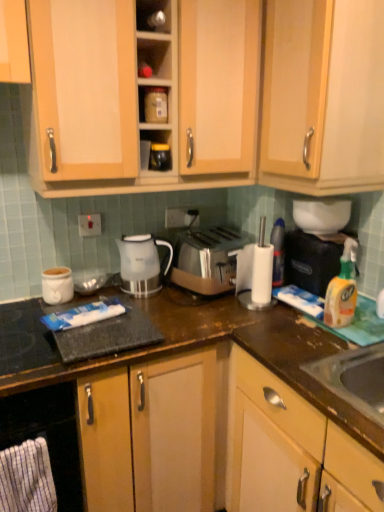
Identify the location of white glossy jar at left, the first appliance positioned from the left. The image size is (384, 512). (57, 285).

Locate an element on the screen. The image size is (384, 512). matte plastic container at upper center, placed as the second shelf when sorted from top to bottom is located at coordinates (153, 104).

I want to click on metallic silver container at upper center, the 1th shelf in the top-to-bottom sequence, so click(154, 16).

From the image's perspective, between white glossy kettle at center and translucent plastic spray bottle at right, placed as the fourth appliance when sorted from left to right, who is located below?

translucent plastic spray bottle at right, placed as the fourth appliance when sorted from left to right.

Which is in front, point (132, 260) or point (306, 273)?

Positioned in front is point (306, 273).

Is white glossy kettle at center positioned far away from translucent plastic spray bottle at right, placed as the fourth appliance when sorted from left to right?

white glossy kettle at center is actually quite close to translucent plastic spray bottle at right, placed as the fourth appliance when sorted from left to right.

Between white glossy kettle at center and translucent plastic spray bottle at right, placed as the fourth appliance when sorted from left to right, which one has smaller size?

white glossy kettle at center is smaller.

In the scene shown: From the image's perspective, which one is positioned higher, white plastic blender at center or translucent plastic spray bottle at right, placed as the fourth appliance when sorted from left to right?

white plastic blender at center appears higher in the image.

Between white plastic blender at center and translucent plastic spray bottle at right, the 1th appliance positioned from the right, which one appears on the right side from the viewer's perspective?

Positioned to the right is translucent plastic spray bottle at right, the 1th appliance positioned from the right.

Is white plastic blender at center situated inside translucent plastic spray bottle at right, the 1th appliance positioned from the right, or outside?

white plastic blender at center lies outside translucent plastic spray bottle at right, the 1th appliance positioned from the right.

From a real-world perspective, which is physically below, white plastic blender at center or translucent plastic spray bottle at right, placed as the fourth appliance when sorted from left to right?

translucent plastic spray bottle at right, placed as the fourth appliance when sorted from left to right, is physically lower.

Is white striped cloth at lower left facing towards light wood cabinet at upper center, which is the 2th cabinetry from top to bottom?

No.

Looking at this image, measure the distance from white striped cloth at lower left to light wood cabinet at upper center, which is the 2th cabinetry from top to bottom.

white striped cloth at lower left and light wood cabinet at upper center, which is the 2th cabinetry from top to bottom, are 1.29 meters apart.

Is white striped cloth at lower left taller than light wood cabinet at upper center, which is the 2th cabinetry from top to bottom?

No.

Is white striped cloth at lower left bigger than light wood cabinet at upper center, which is the 2th cabinetry from top to bottom?

No.

The height and width of the screenshot is (512, 384). What are the coordinates of `kitchen appliance below the white plastic electric outlet at center, which is the first electric outlet in back-to-front order (from a real-world perspective)` in the screenshot? It's located at (141, 264).

Does white plastic electric outlet at center, placed as the second electric outlet when sorted from front to back, come behind white glossy kettle at center?

Yes, the depth of white plastic electric outlet at center, placed as the second electric outlet when sorted from front to back, is greater than that of white glossy kettle at center.

Considering the relative sizes of white plastic electric outlet at center, which is the first electric outlet in back-to-front order, and white glossy kettle at center in the image provided, is white plastic electric outlet at center, which is the first electric outlet in back-to-front order, shorter than white glossy kettle at center?

Yes.

From a real-world perspective, between white plastic electric outlet at center, marked as the 1th electric outlet in a right-to-left arrangement, and white glossy kettle at center, who is vertically higher?

white plastic electric outlet at center, marked as the 1th electric outlet in a right-to-left arrangement, from a real-world perspective.

What's the angular difference between matte plastic container at upper center, placed as the second shelf when sorted from top to bottom, and white glossy kettle at center's facing directions?

There is a 1.17-degree angle between the facing directions of matte plastic container at upper center, placed as the second shelf when sorted from top to bottom, and white glossy kettle at center.

Can you confirm if matte plastic container at upper center, placed as the second shelf when sorted from top to bottom, is wider than white glossy kettle at center?

No.

Which object is positioned more to the right, matte plastic container at upper center, which ranks as the 1th shelf in bottom-to-top order, or white glossy kettle at center?

matte plastic container at upper center, which ranks as the 1th shelf in bottom-to-top order.

Is matte plastic container at upper center, placed as the second shelf when sorted from top to bottom, facing away from white glossy kettle at center?

No.

I want to click on oven that appears below the metallic silver container at upper center, the 1th shelf in the top-to-bottom sequence (from the image's perspective), so click(x=48, y=435).

Looking at this image, can you confirm if metallic silver container at upper center, the 1th shelf in the top-to-bottom sequence, is thinner than black matte oven at lower left?

Yes, metallic silver container at upper center, the 1th shelf in the top-to-bottom sequence, is thinner than black matte oven at lower left.

From a real-world perspective, is metallic silver container at upper center, which is the 2th shelf in bottom-to-top order, beneath black matte oven at lower left?

Actually, metallic silver container at upper center, which is the 2th shelf in bottom-to-top order, is physically above black matte oven at lower left in the real world.

Are white plastic electric outlet at center, marked as the 1th electric outlet in a right-to-left arrangement, and white striped cloth at lower left far apart?

A: Absolutely, white plastic electric outlet at center, marked as the 1th electric outlet in a right-to-left arrangement, is distant from white striped cloth at lower left.

Is white plastic electric outlet at center, placed as the second electric outlet when sorted from front to back, facing away from white striped cloth at lower left?

No, white plastic electric outlet at center, placed as the second electric outlet when sorted from front to back, is not facing the opposite direction of white striped cloth at lower left.

Measure the distance from white plastic electric outlet at center, positioned as the 2th electric outlet in left-to-right order, to white striped cloth at lower left.

1.05 meters.

Which is more to the left, white plastic electric outlet at center, placed as the second electric outlet when sorted from front to back, or white striped cloth at lower left?

From the viewer's perspective, white striped cloth at lower left appears more on the left side.

Where is `kitchen appliance located above the translucent plastic spray bottle at right, the 1th appliance positioned from the right (from the image's perspective)`? The image size is (384, 512). kitchen appliance located above the translucent plastic spray bottle at right, the 1th appliance positioned from the right (from the image's perspective) is located at coordinates (141, 264).

Find the location of a particular element. Image resolution: width=384 pixels, height=512 pixels. the 1st appliance below the white plastic blender at center (from the image's perspective) is located at coordinates (311, 261).

Based on their spatial positions, is satin silver toaster at center or white plastic paper towel holder at right closer to metallic silver container at upper center, which is the 2th shelf in bottom-to-top order?

Among the two, satin silver toaster at center is located nearer to metallic silver container at upper center, which is the 2th shelf in bottom-to-top order.

Based on their spatial positions, is wooden cabinet at center, which is counted as the 1th cabinetry, starting from the bottom, or matte plastic container at upper center, placed as the second shelf when sorted from top to bottom, closer to satin silver toaster at center?

Among the two, wooden cabinet at center, which is counted as the 1th cabinetry, starting from the bottom, is located nearer to satin silver toaster at center.

Considering their positions, is satin silver toaster at center positioned closer to white plastic electric outlet at center, positioned as the 2th electric outlet in left-to-right order, than white plastic paper towel holder at right?

Among the two, satin silver toaster at center is located nearer to white plastic electric outlet at center, positioned as the 2th electric outlet in left-to-right order.

From the image, which object appears to be nearer to white plastic electric outlet at center, placed as the second electric outlet when sorted from front to back, wooden cabinet at center, which is counted as the 1th cabinetry, starting from the bottom, or matte plastic container at upper center, placed as the second shelf when sorted from top to bottom?

matte plastic container at upper center, placed as the second shelf when sorted from top to bottom.

When comparing their distances from black matte oven at lower left, does wooden cabinet at upper center, the 1th cabinetry viewed from the top, or light wood cabinet at upper center, which is the 2th cabinetry from top to bottom, seem further?

Based on the image, light wood cabinet at upper center, which is the 2th cabinetry from top to bottom, appears to be further to black matte oven at lower left.

When comparing their distances from white plastic paper towel holder at right, does light wood cabinet at upper center, which is the 2th cabinetry from top to bottom, or white striped cloth at lower left seem further?

The object further to white plastic paper towel holder at right is white striped cloth at lower left.

When comparing their distances from shiny black jar at center, positioned as the second appliance in left-to-right order, does light wood cabinet at upper center, which is the 2th cabinetry from top to bottom, or white plastic electric outlet at center, placed as the second electric outlet when sorted from front to back, seem further?

The object further to shiny black jar at center, positioned as the second appliance in left-to-right order, is light wood cabinet at upper center, which is the 2th cabinetry from top to bottom.

Considering their positions, is translucent plastic spray bottle at right, the 1th appliance positioned from the right, positioned further to light wood cabinet at upper center, which is the 2th cabinetry from top to bottom, than metallic silver container at upper center, the 1th shelf in the top-to-bottom sequence?

Among the two, metallic silver container at upper center, the 1th shelf in the top-to-bottom sequence, is located further to light wood cabinet at upper center, which is the 2th cabinetry from top to bottom.

Locate an element on the screen. blender between wooden cabinet at upper center, the 1th cabinetry viewed from the top, and white glossy jar at left, the first appliance positioned from the left, in the up-down direction is located at coordinates (255, 273).

This screenshot has height=512, width=384. I want to click on electric outlet between matte plastic container at upper center, which ranks as the 1th shelf in bottom-to-top order, and white glossy bowl at upper right, acting as the third appliance starting from the left, so click(x=181, y=217).

Find the location of a particular element. blender between white glossy jar at left, which is counted as the fourth appliance, starting from the right, and white glossy bowl at upper right, acting as the third appliance starting from the left, in the horizontal direction is located at coordinates (255, 273).

Image resolution: width=384 pixels, height=512 pixels. I want to click on cabinetry between shiny black jar at center, positioned as the second appliance in left-to-right order, and white glossy bowl at upper right, acting as the third appliance starting from the left, so click(323, 96).